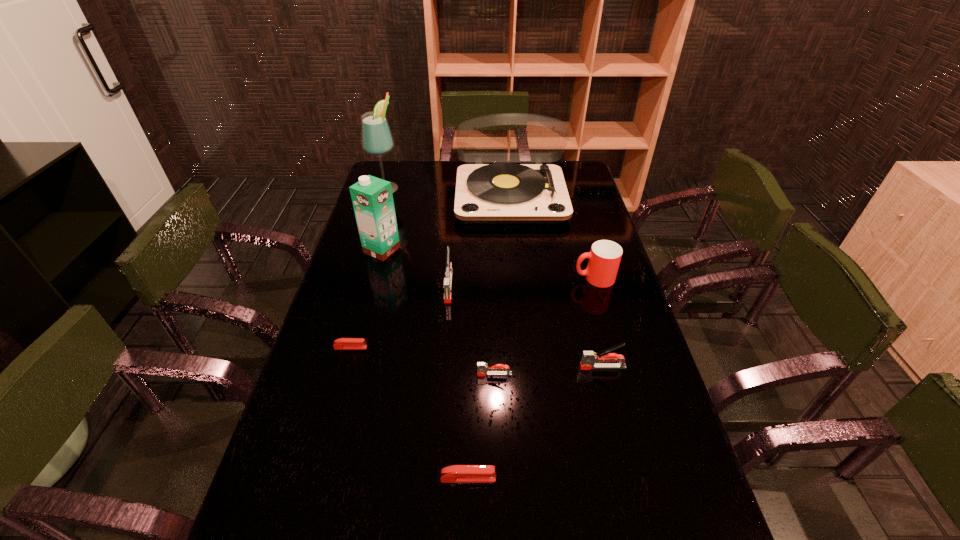
At what (x,y) coordinates should I click in order to perform the action: click on alcohol. Please return your answer as a coordinate pair (x, y). Looking at the image, I should click on (377, 140).

Find the location of a particular element. The height and width of the screenshot is (540, 960). record player is located at coordinates (500, 193).

The height and width of the screenshot is (540, 960). Find the location of `the seventh shortest object`. the seventh shortest object is located at coordinates (372, 198).

Locate an element on the screen. This screenshot has width=960, height=540. carton is located at coordinates (372, 198).

Locate an element on the screen. Image resolution: width=960 pixels, height=540 pixels. the second stapler from left to right is located at coordinates (447, 282).

The height and width of the screenshot is (540, 960). Find the location of `the farthest gray stapler`. the farthest gray stapler is located at coordinates coord(447,282).

Locate an element on the screen. This screenshot has width=960, height=540. red cup is located at coordinates (604, 258).

Where is `the third nearest stapler`? the third nearest stapler is located at coordinates (588, 360).

In order to click on the second tallest stapler in this screenshot , I will do `click(588, 360)`.

Where is `the seventh tallest object`? the seventh tallest object is located at coordinates (483, 369).